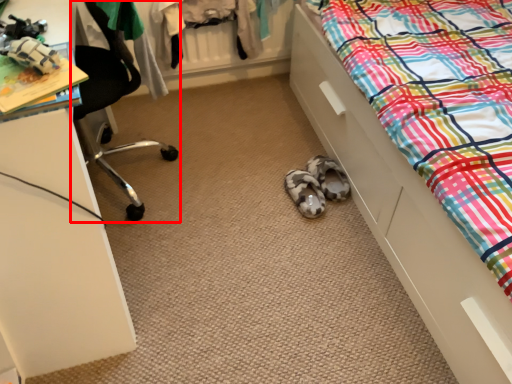
Question: From the image's perspective, considering the relative positions of chair (annotated by the red box) and bed in the image provided, where is chair (annotated by the red box) located with respect to the staircase?

Choices:
 (A) below
 (B) above

Answer: (B)